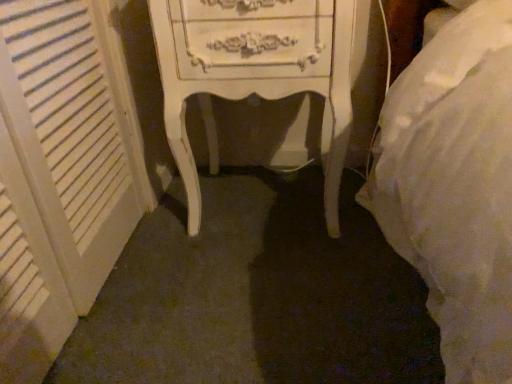
Identify the location of white painted wood chest of drawers at center. This screenshot has width=512, height=384. (258, 71).

This screenshot has height=384, width=512. What do you see at coordinates (258, 71) in the screenshot?
I see `white painted wood chest of drawers at center` at bounding box center [258, 71].

Measure the distance between point (214, 60) and camera.

The distance of point (214, 60) from camera is 32.83 inches.

Find the location of a particular element. white painted wood chest of drawers at center is located at coordinates (258, 71).